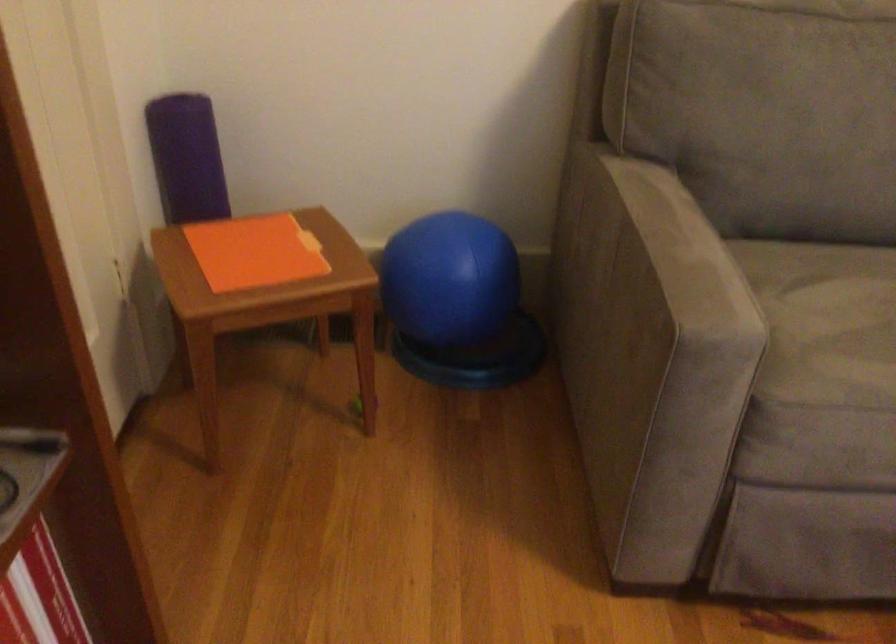
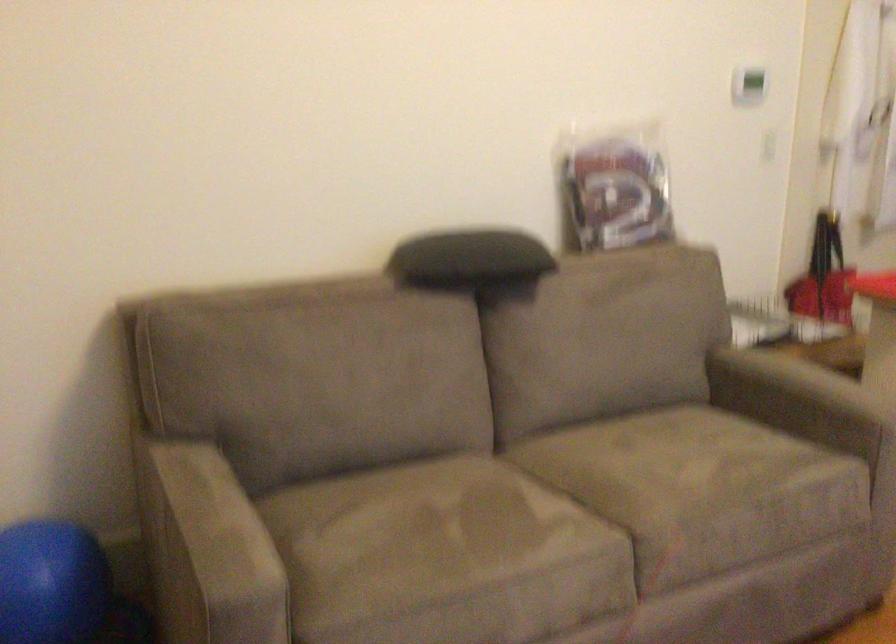
Find the pixel in the second image that matches (x=478, y=274) in the first image.

(49, 583)